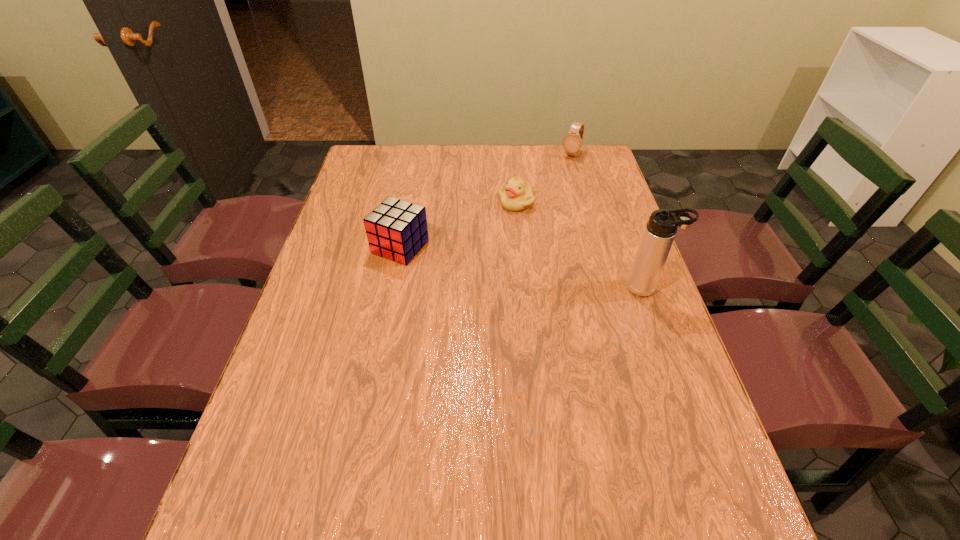
The width and height of the screenshot is (960, 540). I want to click on vacant region located on the front-facing side of the duckling, so click(505, 236).

At what (x,y) coordinates should I click in order to perform the action: click on free location located on the front-facing side of the duckling. Please return your answer as a coordinate pair (x, y). The image size is (960, 540). Looking at the image, I should click on (509, 226).

The width and height of the screenshot is (960, 540). Find the location of `free spot located on the face of the second object from right to left`. free spot located on the face of the second object from right to left is located at coordinates (541, 195).

Where is `vacant point located on the face of the second object from right to left`? Image resolution: width=960 pixels, height=540 pixels. vacant point located on the face of the second object from right to left is located at coordinates pyautogui.click(x=539, y=199).

The height and width of the screenshot is (540, 960). I want to click on free space located on the face of the second object from right to left, so click(x=538, y=200).

Find the location of a particular element. This screenshot has height=540, width=960. object that is at the far edge is located at coordinates (572, 142).

What are the coordinates of `object that is at the left edge` in the screenshot? It's located at (397, 230).

The width and height of the screenshot is (960, 540). What are the coordinates of `thermos bottle situated at the right edge` in the screenshot? It's located at (660, 231).

Where is `watch that is positioned at the right edge`? The height and width of the screenshot is (540, 960). watch that is positioned at the right edge is located at coordinates (572, 142).

You are a GUI agent. You are given a task and a screenshot of the screen. Output one action in this format:
    pyautogui.click(x=<x>, y=<y>)
    Task: Click on the object positioned at the far right corner
    The width and height of the screenshot is (960, 540).
    Given the screenshot: What is the action you would take?
    pyautogui.click(x=572, y=142)